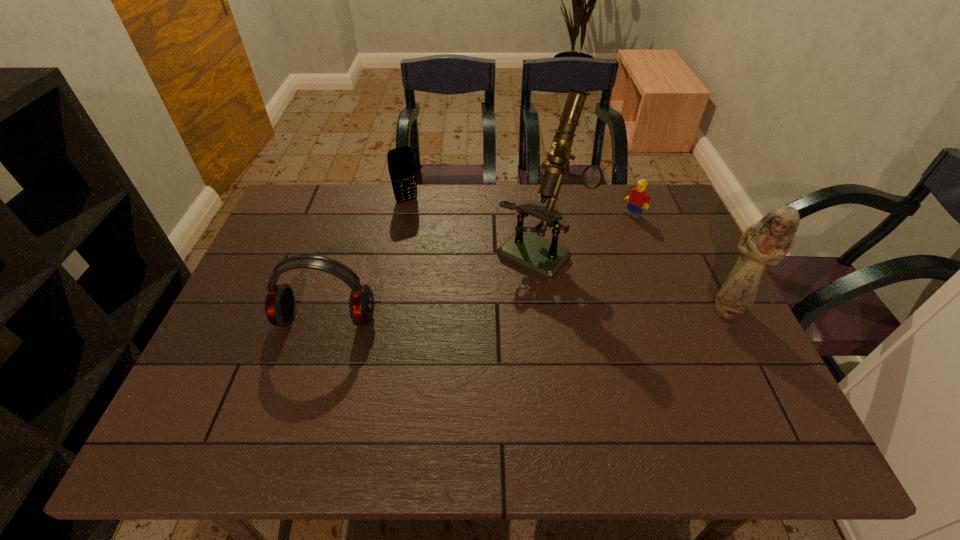
You are a GUI agent. You are given a task and a screenshot of the screen. Output one action in this format:
    pyautogui.click(x=<x>, y=<y>)
    Task: Click on the Lego at the far edge
    
    Given the screenshot: What is the action you would take?
    pyautogui.click(x=638, y=198)

What are the coordinates of `microscope at the far edge` in the screenshot? It's located at (544, 258).

Identify the location of object that is at the left edge. The height and width of the screenshot is (540, 960). (280, 302).

What are the coordinates of `figurine that is at the right edge` in the screenshot? It's located at (765, 243).

I want to click on Lego located in the right edge section of the desktop, so click(x=638, y=198).

Find the location of a particular element. The height and width of the screenshot is (540, 960). object present at the far right corner is located at coordinates (638, 198).

In the image, there is a desktop. Identify the location of blank space at the far edge. This screenshot has height=540, width=960. (470, 231).

Where is `vacant area at the near edge`? The width and height of the screenshot is (960, 540). vacant area at the near edge is located at coordinates (623, 386).

Find the location of a particular element. The image size is (960, 540). free space at the left edge of the desktop is located at coordinates (288, 279).

This screenshot has height=540, width=960. I want to click on vacant area at the right edge of the desktop, so click(x=648, y=235).